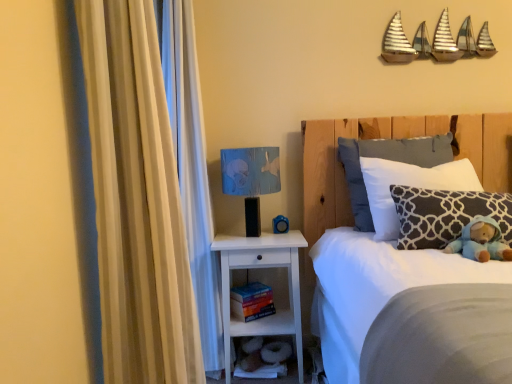
Question: Considering the positions of blue rubber duck at lower center and hardcover book at lower center in the image, is blue rubber duck at lower center wider or thinner than hardcover book at lower center?

Choices:
 (A) thin
 (B) wide

Answer: (A)

Question: Considering the positions of point (278, 218) and point (258, 281), is point (278, 218) closer or farther from the camera than point (258, 281)?

Choices:
 (A) closer
 (B) farther

Answer: (A)

Question: Which is farther from the dark gray patterned pillow at right, placed as the first pillow when sorted from front to back?

Choices:
 (A) blue rubber duck at lower center
 (B) white wood nightstand at lower center
 (C) blue plush toy at right
 (D) blue fabric lampshade at upper right
 (E) dark gray textured pillow at upper right, which appears as the 2th pillow when viewed from the back

Answer: (A)

Question: Based on their relative distances, which object is nearer to the dark gray patterned pillow at right, placed as the first pillow when sorted from front to back?

Choices:
 (A) blue plush toy at right
 (B) white soft bed at upper right
 (C) blue rubber duck at lower center
 (D) beige fabric curtain at left
 (E) blue fabric lampshade at upper right

Answer: (A)